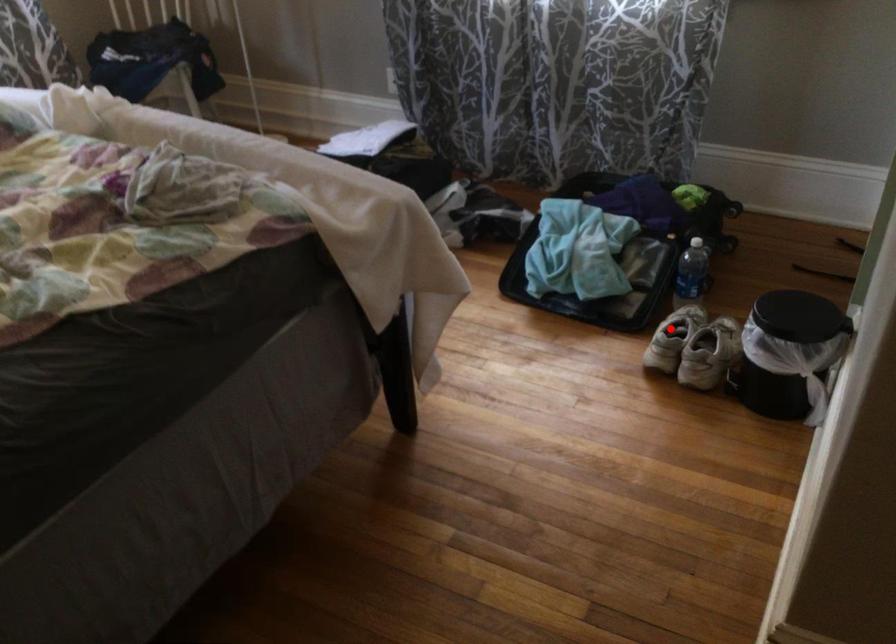
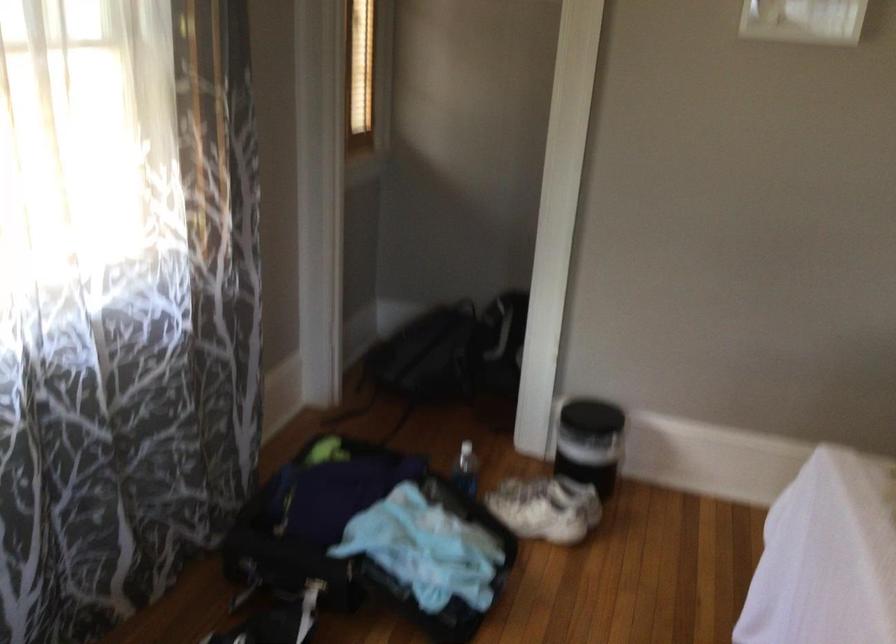
Where in the second image is the point corresponding to the highlighted location from the first image?

(546, 507)